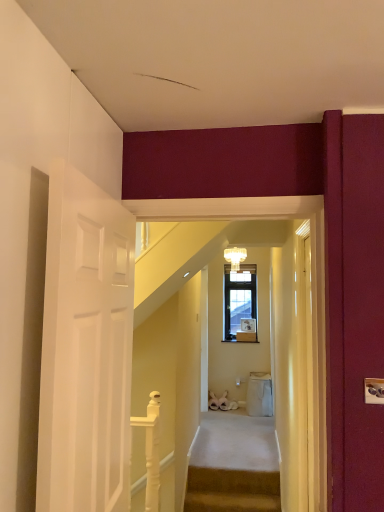
Image resolution: width=384 pixels, height=512 pixels. Describe the element at coordinates (259, 394) in the screenshot. I see `beige fabric trash bin at lower center` at that location.

What is the approximate width of white carpeted stairs at center, arranged as the 1th stairs when viewed from the top?

white carpeted stairs at center, arranged as the 1th stairs when viewed from the top, is 6.32 feet in width.

Where is `wooden frame at center`? This screenshot has width=384, height=512. wooden frame at center is located at coordinates (246, 336).

This screenshot has height=512, width=384. What are the coordinates of `white glossy balustrade at lower center` in the screenshot? It's located at (151, 450).

What do you see at coordinates (232, 490) in the screenshot? This screenshot has height=512, width=384. I see `carpeted stairs at center, positioned as the 1th stairs in bottom-to-top order` at bounding box center [232, 490].

Locate an element on the screen. The height and width of the screenshot is (512, 384). beige fabric trash bin at lower center is located at coordinates (259, 394).

Considering the relative sizes of beige fabric trash bin at lower center and white glossy balustrade at lower center in the image provided, is beige fabric trash bin at lower center smaller than white glossy balustrade at lower center?

No.

How distant is beige fabric trash bin at lower center from white glossy balustrade at lower center?

The distance of beige fabric trash bin at lower center from white glossy balustrade at lower center is 8.39 feet.

From the image's perspective, which object appears higher, beige fabric trash bin at lower center or white glossy balustrade at lower center?

white glossy balustrade at lower center appears higher in the image.

Is the depth of beige fabric trash bin at lower center less than that of white glossy balustrade at lower center?

No, beige fabric trash bin at lower center is further to the viewer.

Considering the sizes of objects carpeted stairs at center, which is the second stairs in top-to-bottom order, and beige fabric trash bin at lower center in the image provided, who is thinner, carpeted stairs at center, which is the second stairs in top-to-bottom order, or beige fabric trash bin at lower center?

With smaller width is carpeted stairs at center, which is the second stairs in top-to-bottom order.

Considering the positions of objects carpeted stairs at center, which is the second stairs in top-to-bottom order, and beige fabric trash bin at lower center in the image provided, who is behind, carpeted stairs at center, which is the second stairs in top-to-bottom order, or beige fabric trash bin at lower center?

beige fabric trash bin at lower center is further away from the camera.

Consider the image. Is carpeted stairs at center, which is the second stairs in top-to-bottom order, not close to beige fabric trash bin at lower center?

carpeted stairs at center, which is the second stairs in top-to-bottom order, is positioned a significant distance from beige fabric trash bin at lower center.

From the image's perspective, does white carpeted stairs at center, arranged as the 1th stairs when viewed from the top, appear higher than white glossy balustrade at lower center?

Actually, white carpeted stairs at center, arranged as the 1th stairs when viewed from the top, appears below white glossy balustrade at lower center in the image.

Is white carpeted stairs at center, which is the 2th stairs in front-to-back order, oriented towards white glossy balustrade at lower center?

No, white carpeted stairs at center, which is the 2th stairs in front-to-back order, is not facing towards white glossy balustrade at lower center.

Looking at this image, is white carpeted stairs at center, the 2th stairs in the bottom-to-top sequence, to the right of white glossy balustrade at lower center from the viewer's perspective?

Yes, white carpeted stairs at center, the 2th stairs in the bottom-to-top sequence, is to the right of white glossy balustrade at lower center.

Is carpeted stairs at center, positioned as the second stairs in back-to-front order, facing away from crystal glass chandelier at upper center?

No.

Does carpeted stairs at center, positioned as the 1th stairs in bottom-to-top order, have a smaller size compared to crystal glass chandelier at upper center?

No.

Considering the positions of points (225, 482) and (232, 270), is point (225, 482) closer to camera compared to point (232, 270)?

Yes, point (225, 482) is closer to viewer.

The width and height of the screenshot is (384, 512). In order to click on balustrade that appears above the carpeted stairs at center, the 1th stairs in the front-to-back sequence (from the image's perspective) in this screenshot , I will do `click(151, 450)`.

Does point (196, 507) appear closer or farther from the camera than point (134, 419)?

Point (196, 507) is positioned farther from the camera compared to point (134, 419).

How much distance is there between carpeted stairs at center, positioned as the second stairs in back-to-front order, and white glossy balustrade at lower center?

A distance of 28.61 inches exists between carpeted stairs at center, positioned as the second stairs in back-to-front order, and white glossy balustrade at lower center.

From a real-world perspective, who is located lower, carpeted stairs at center, positioned as the 1th stairs in bottom-to-top order, or white glossy balustrade at lower center?

carpeted stairs at center, positioned as the 1th stairs in bottom-to-top order.

Would you consider crystal glass chandelier at upper center to be distant from white glossy balustrade at lower center?

crystal glass chandelier at upper center is far away from white glossy balustrade at lower center.

Looking at this image, from a real-world perspective, which object stands above the other?

crystal glass chandelier at upper center.

Which is closer, (229,256) or (131,490)?

Clearly, point (229,256) is more distant from the camera than point (131,490).

Is white glossy balustrade at lower center wider or thinner than beige fabric trash bin at lower center?

white glossy balustrade at lower center is thinner than beige fabric trash bin at lower center.

From the image's perspective, is white glossy balustrade at lower center located above beige fabric trash bin at lower center?

Indeed, from the image's perspective, white glossy balustrade at lower center is shown above beige fabric trash bin at lower center.

How many degrees apart are the facing directions of white glossy balustrade at lower center and beige fabric trash bin at lower center?

They differ by 91.1 degrees in their facing directions.

Considering the sizes of white glossy balustrade at lower center and beige fabric trash bin at lower center in the image, is white glossy balustrade at lower center bigger or smaller than beige fabric trash bin at lower center?

Clearly, white glossy balustrade at lower center is smaller in size than beige fabric trash bin at lower center.

I want to click on balustrade that is above the beige fabric trash bin at lower center (from a real-world perspective), so click(151, 450).

Find the location of a particular element. trash bin/can on the right of carpeted stairs at center, the 1th stairs in the front-to-back sequence is located at coordinates (x=259, y=394).

Which object lies further to the anchor point crystal glass chandelier at upper center, white glossy balustrade at lower center or beige fabric trash bin at lower center?

Based on the image, white glossy balustrade at lower center appears to be further to crystal glass chandelier at upper center.

Estimate the real-world distances between objects in this image. Which object is closer to wooden frame at center, beige fabric trash bin at lower center or crystal glass chandelier at upper center?

Among the two, beige fabric trash bin at lower center is located nearer to wooden frame at center.

Considering their positions, is white carpeted stairs at center, which is the 2th stairs in front-to-back order, positioned closer to wooden frame at center than white glossy balustrade at lower center?

The object closer to wooden frame at center is white carpeted stairs at center, which is the 2th stairs in front-to-back order.

Estimate the real-world distances between objects in this image. Which object is further from white carpeted stairs at center, the 2th stairs in the bottom-to-top sequence, white glossy balustrade at lower center or carpeted stairs at center, positioned as the second stairs in back-to-front order?

white glossy balustrade at lower center.

Based on the photo, from the image, which object appears to be farther from carpeted stairs at center, positioned as the second stairs in back-to-front order, white carpeted stairs at center, the first stairs when ordered from back to front, or white glossy balustrade at lower center?

white glossy balustrade at lower center is positioned further to the anchor carpeted stairs at center, positioned as the second stairs in back-to-front order.

Based on the photo, looking at the image, which one is located further to wooden frame at center, carpeted stairs at center, which is the second stairs in top-to-bottom order, or beige fabric trash bin at lower center?

Among the two, carpeted stairs at center, which is the second stairs in top-to-bottom order, is located further to wooden frame at center.

Looking at the image, which one is located further to wooden frame at center, white carpeted stairs at center, arranged as the 1th stairs when viewed from the top, or carpeted stairs at center, positioned as the 1th stairs in bottom-to-top order?

carpeted stairs at center, positioned as the 1th stairs in bottom-to-top order, is positioned further to the anchor wooden frame at center.

When comparing their distances from carpeted stairs at center, which is the second stairs in top-to-bottom order, does beige fabric trash bin at lower center or white glossy balustrade at lower center seem further?

Among the two, beige fabric trash bin at lower center is located further to carpeted stairs at center, which is the second stairs in top-to-bottom order.

This screenshot has height=512, width=384. Find the location of `stairs between carpeted stairs at center, positioned as the second stairs in back-to-front order, and wooden frame at center, along the z-axis`. stairs between carpeted stairs at center, positioned as the second stairs in back-to-front order, and wooden frame at center, along the z-axis is located at coordinates (234, 465).

Where is `lamp located between white glossy balustrade at lower center and beige fabric trash bin at lower center in the depth direction`? lamp located between white glossy balustrade at lower center and beige fabric trash bin at lower center in the depth direction is located at coordinates (235, 257).

You are a GUI agent. You are given a task and a screenshot of the screen. Output one action in this format:
    pyautogui.click(x=<x>, y=<y>)
    Task: Click on the stairs between crystal glass chandelier at upper center and carpeted stairs at center, positioned as the 1th stairs in bottom-to-top order, vertically
    Image resolution: width=384 pixels, height=512 pixels.
    Given the screenshot: What is the action you would take?
    pyautogui.click(x=234, y=465)

Identify the location of lamp between carpeted stairs at center, positioned as the second stairs in back-to-front order, and wooden frame at center in the front-back direction. This screenshot has height=512, width=384. (235, 257).